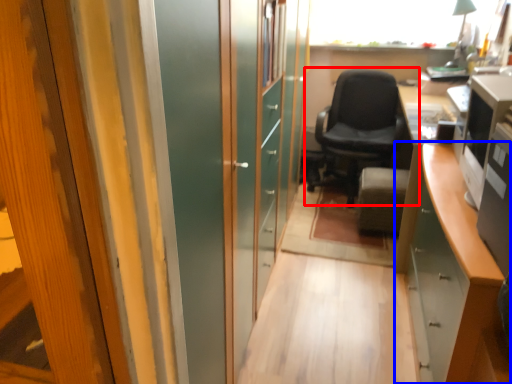
Question: Which point is further to the camera, chair (highlighted by a red box) or cabinetry (highlighted by a blue box)?

Choices:
 (A) chair
 (B) cabinetry

Answer: (A)